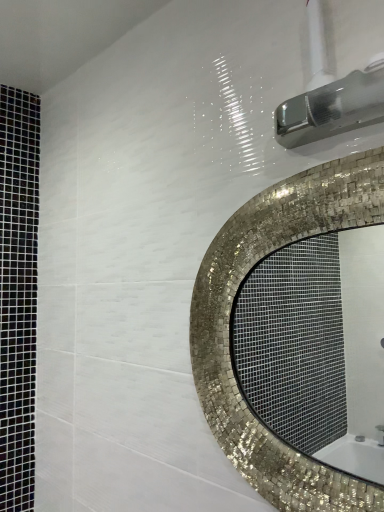
Question: Is brushed metal showerhead at upper right surrounding mosaic tile mirror at center?

Choices:
 (A) yes
 (B) no

Answer: (B)

Question: From the image's perspective, is brushed metal showerhead at upper right below mosaic tile mirror at center?

Choices:
 (A) no
 (B) yes

Answer: (A)

Question: Does brushed metal showerhead at upper right have a smaller size compared to mosaic tile mirror at center?

Choices:
 (A) no
 (B) yes

Answer: (B)

Question: Is mosaic tile mirror at center at the back of brushed metal showerhead at upper right?

Choices:
 (A) no
 (B) yes

Answer: (A)

Question: Can you confirm if brushed metal showerhead at upper right is positioned to the right of mosaic tile mirror at center?

Choices:
 (A) no
 (B) yes

Answer: (B)

Question: Considering the relative sizes of brushed metal showerhead at upper right and mosaic tile mirror at center in the image provided, is brushed metal showerhead at upper right wider than mosaic tile mirror at center?

Choices:
 (A) yes
 (B) no

Answer: (A)

Question: Are mosaic tile mirror at center and brushed metal showerhead at upper right far apart?

Choices:
 (A) no
 (B) yes

Answer: (B)

Question: Can you confirm if mosaic tile mirror at center is shorter than brushed metal showerhead at upper right?

Choices:
 (A) yes
 (B) no

Answer: (B)

Question: Is mosaic tile mirror at center taller than brushed metal showerhead at upper right?

Choices:
 (A) yes
 (B) no

Answer: (A)

Question: Could you tell me if mosaic tile mirror at center is facing brushed metal showerhead at upper right?

Choices:
 (A) no
 (B) yes

Answer: (A)

Question: Is mosaic tile mirror at center at the left side of brushed metal showerhead at upper right?

Choices:
 (A) yes
 (B) no

Answer: (A)

Question: Is mosaic tile mirror at center wider than brushed metal showerhead at upper right?

Choices:
 (A) no
 (B) yes

Answer: (A)

Question: Is mosaic tile mirror at center wider or thinner than brushed metal showerhead at upper right?

Choices:
 (A) wide
 (B) thin

Answer: (B)